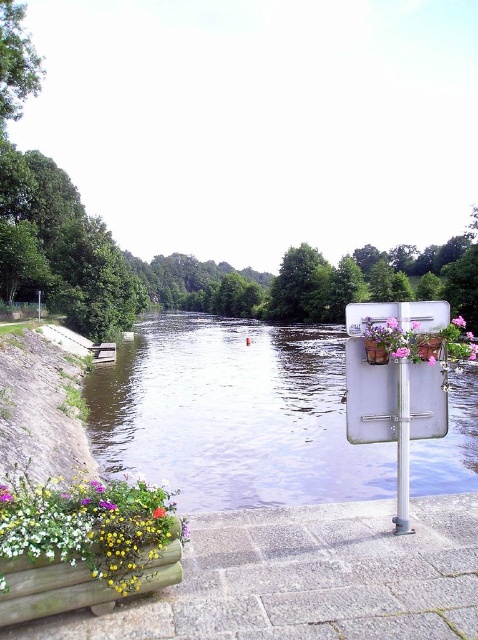
You are a gardener who wants to place a new decorative item between the clear water at center and the pink fabric flower at center right. Which side should you place it on if you want it to be closer to the larger object?

The clear water at center is bigger than the pink fabric flower at center right, so placing the new item closer to the clear water at center would position it near the larger object.

You are standing at the point marked by coordinates (87, 525) in the image. What object are you standing on?

The point marked by coordinates (87, 525) is on the wooden planter at lower left.

You are standing at the riverside and want to place a small bench on the granite paving stones at lower center. What are the coordinates where you should place the bench?

The coordinates for the granite paving stones at lower center are at point (306, 579).